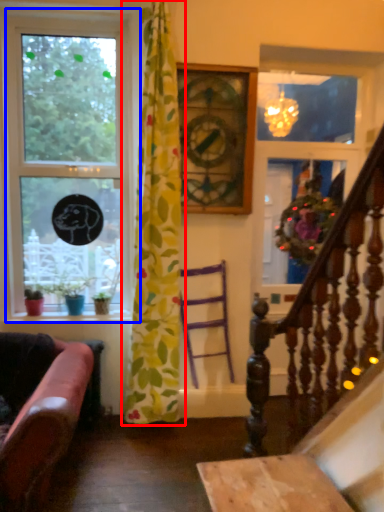
Question: Which object is further to the camera taking this photo, curtain (highlighted by a red box) or window (highlighted by a blue box)?

Choices:
 (A) curtain
 (B) window

Answer: (B)